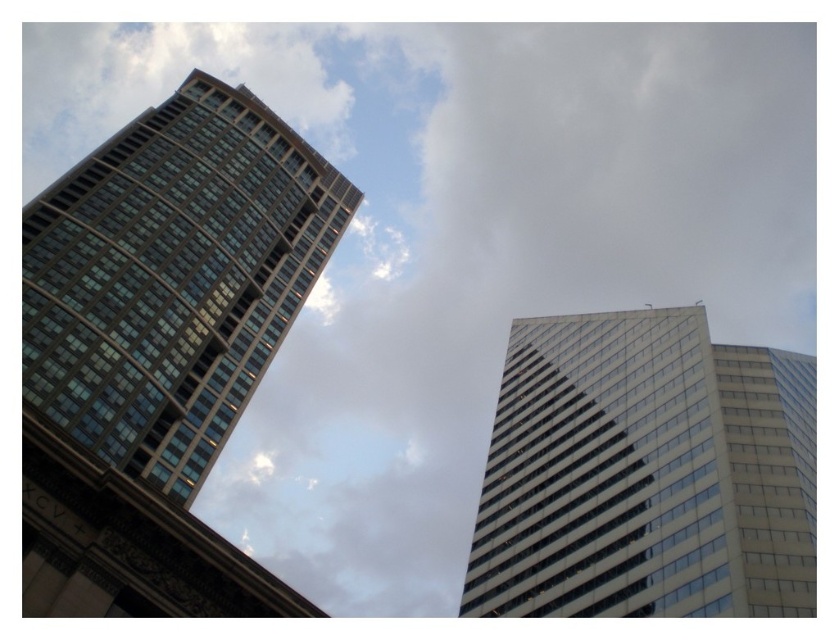
You are standing on the ground floor of the left building and want to take a photo of the point at coordinates point (688, 556). Given that your camera has a maximum zoom range of 50 meters, can you capture the point in your photo?

The point (688, 556) is 48.00 meters away from the camera, which is within the camera maximum zoom range of 50 meters. Therefore, the point can be captured in the photo.

You are standing on the ground floor of the glassy reflective building at left and want to see the white glass building at upper right. Which direction should you look to see it?

You should look to the right to see the white glass building at upper right since it is positioned to the right of the glassy reflective building at left.